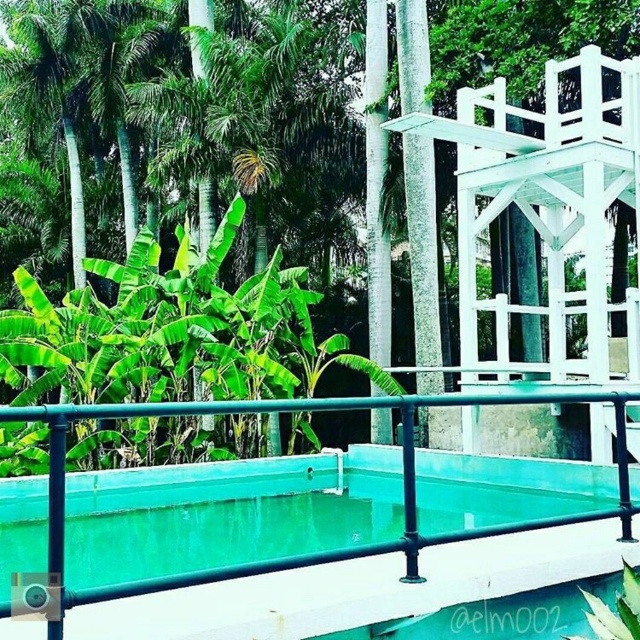
Question: Which object appears closest to the camera in this image?

Choices:
 (A) white painted wood gazebo at upper right
 (B) teal glossy pool at center

Answer: (A)

Question: Does teal glossy pool at center have a greater width compared to white painted wood gazebo at upper right?

Choices:
 (A) yes
 (B) no

Answer: (B)

Question: Can you confirm if teal glossy pool at center is positioned above green leafy tree at center?

Choices:
 (A) yes
 (B) no

Answer: (B)

Question: Which point is farther to the camera?

Choices:
 (A) green leafy tree at center
 (B) teal glossy pool at center
 (C) white painted wood gazebo at upper right

Answer: (A)

Question: Observing the image, what is the correct spatial positioning of white painted wood gazebo at upper right in reference to green leafy tree at center?

Choices:
 (A) below
 (B) above

Answer: (A)

Question: Which of these objects is positioned closest to the green leafy tree at center?

Choices:
 (A) teal glossy pool at center
 (B) white painted wood gazebo at upper right

Answer: (B)